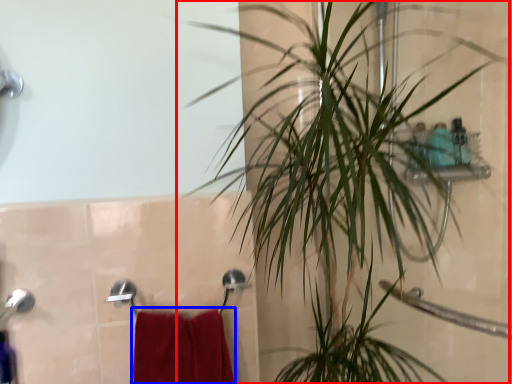
Question: Which object appears closest to the camera in this image, houseplant (highlighted by a red box) or bath towel (highlighted by a blue box)?

Choices:
 (A) houseplant
 (B) bath towel

Answer: (A)